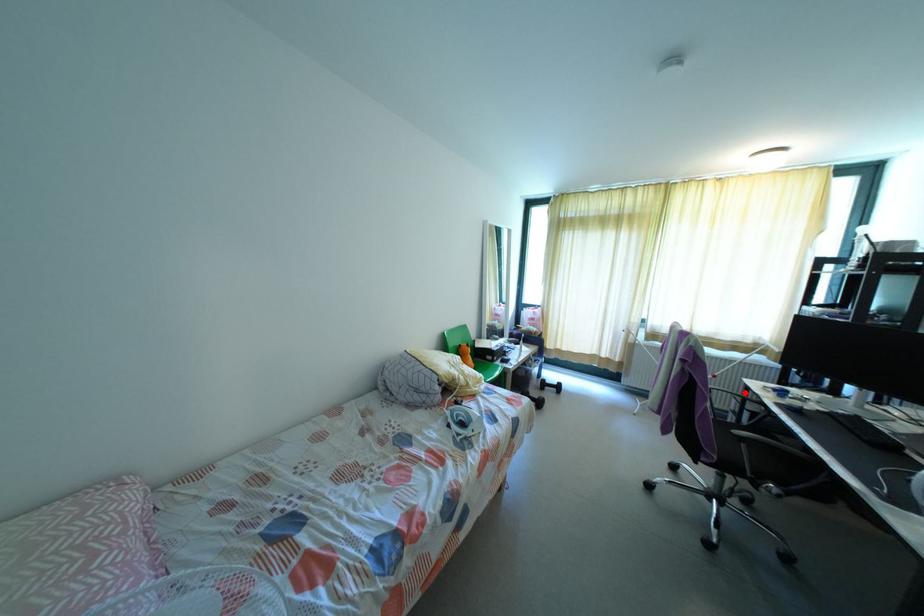
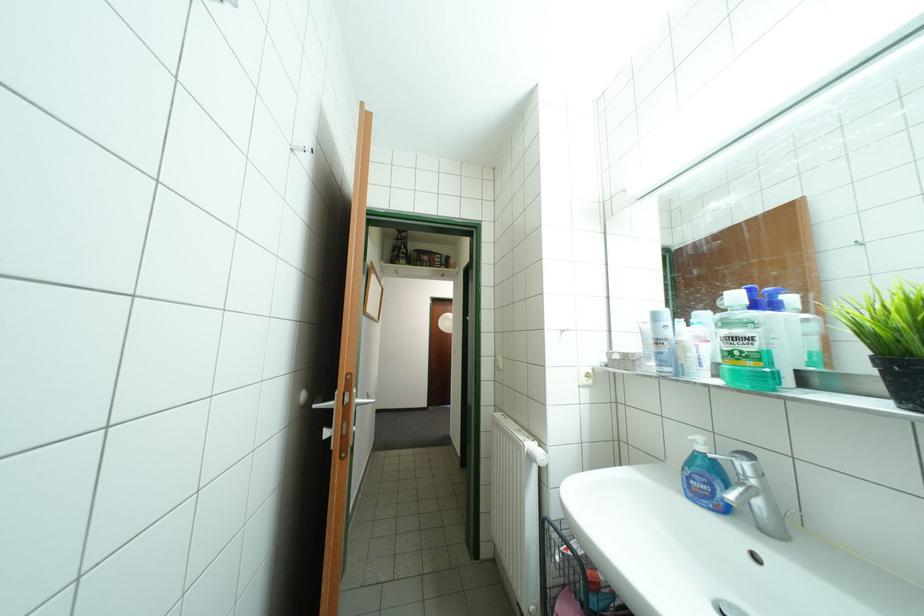
Question: I am providing you with two images of the same scene from different viewpoints. A red point is marked on the first image. Is the red point's position out of view in image 2?

Choices:
 (A) Yes
 (B) No

Answer: (A)